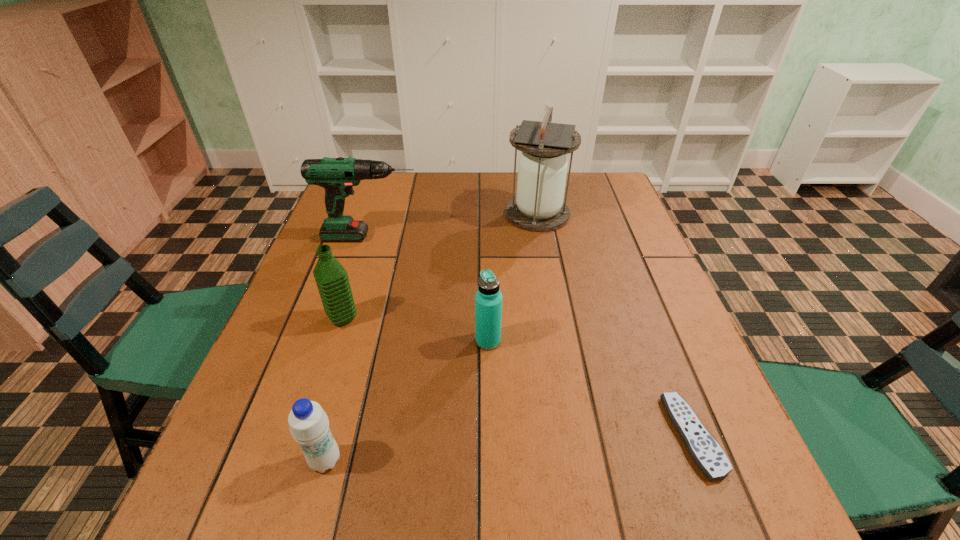
At what (x,y) coordinates should I click in order to perform the action: click on free space between the fourth farthest object and the tallest object. Please return your answer as a coordinate pair (x, y). The width and height of the screenshot is (960, 540). Looking at the image, I should click on [513, 278].

Locate an element on the screen. The height and width of the screenshot is (540, 960). empty space that is in between the farthest water bottle and the rightmost water bottle is located at coordinates (416, 330).

Find the location of a particular element. The image size is (960, 540). vacant area that lies between the shortest object and the lantern is located at coordinates (615, 325).

Choose which object is the fourth nearest neighbor to the lantern. Please provide its 2D coordinates. Your answer should be formatted as a tuple, i.e. [(x, y)], where the tuple contains the x and y coordinates of a point satisfying the conditions above.

[(707, 454)]

Find the location of a particular element. object that stands as the third closest to the drill is located at coordinates (488, 299).

Select which water bottle is the second closest to the third farthest object. Please provide its 2D coordinates. Your answer should be formatted as a tuple, i.e. [(x, y)], where the tuple contains the x and y coordinates of a point satisfying the conditions above.

[(309, 425)]

Select which water bottle is the closest to the drill. Please provide its 2D coordinates. Your answer should be formatted as a tuple, i.e. [(x, y)], where the tuple contains the x and y coordinates of a point satisfying the conditions above.

[(331, 278)]

Identify the location of free location that satisfies the following two spatial constraints: 1. on the handle side of the shortest object; 2. on the right side of the fifth shortest object. The height and width of the screenshot is (540, 960). (308, 436).

Image resolution: width=960 pixels, height=540 pixels. Identify the location of free spot that satisfies the following two spatial constraints: 1. on the back side of the shortest object; 2. on the handle side of the fifth shortest object. (615, 237).

The width and height of the screenshot is (960, 540). In order to click on blank area in the image that satisfies the following two spatial constraints: 1. on the handle side of the second tallest object; 2. on the back side of the rightmost water bottle in this screenshot , I will do `click(339, 341)`.